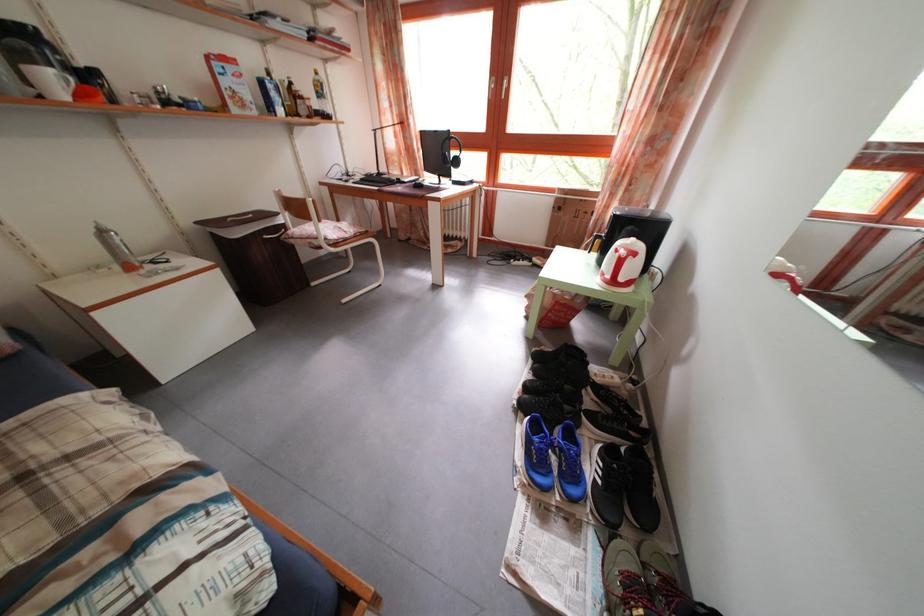
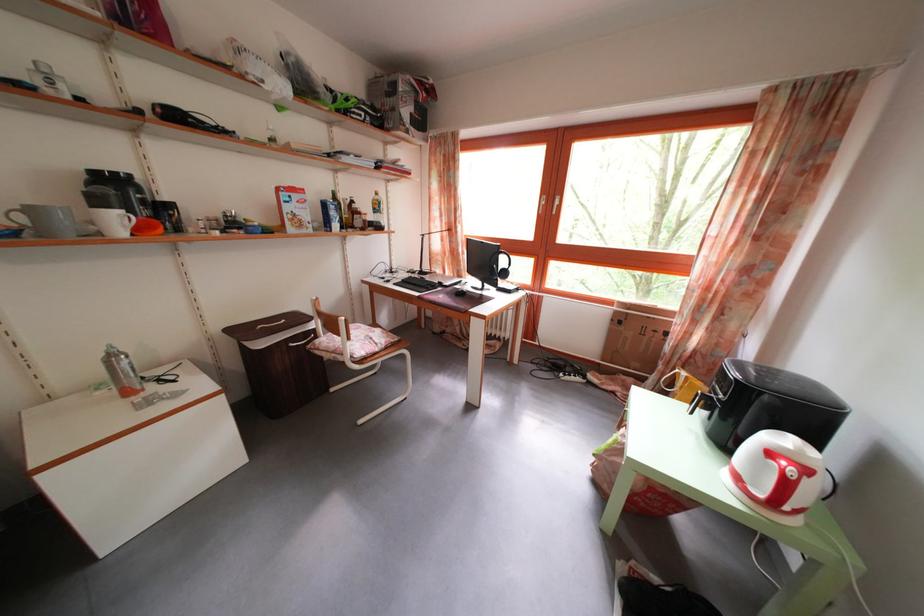
Where in the second image is the point corresponding to pixel 641 262 from the first image?

(812, 477)